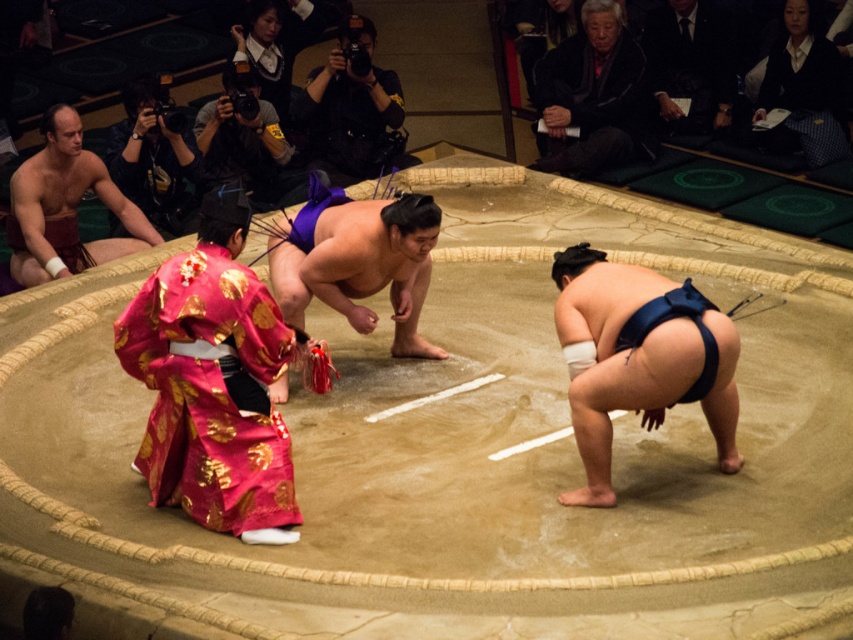
Question: Is black woolen sweater at upper center smaller than black camera at upper left?

Choices:
 (A) yes
 (B) no

Answer: (B)

Question: Does black fabric at upper right appear under matte black camera at upper left?

Choices:
 (A) yes
 (B) no

Answer: (B)

Question: Which object is positioned closest to the matte black camera at upper left?

Choices:
 (A) black woolen sweater at upper center
 (B) shiny pink kimono at lower left
 (C) black fabric at upper right

Answer: (A)

Question: Can you confirm if shiny pink kimono at lower left is positioned to the right of smooth maroon fabric at upper left?

Choices:
 (A) no
 (B) yes

Answer: (B)

Question: Which point is closer to the camera?

Choices:
 (A) click(x=177, y=442)
 (B) click(x=202, y=113)

Answer: (A)

Question: Which object appears farthest from the camera in this image?

Choices:
 (A) shiny pink kimono at lower left
 (B) black fabric at upper right
 (C) black camera at center
 (D) smooth maroon fabric at upper left

Answer: (B)